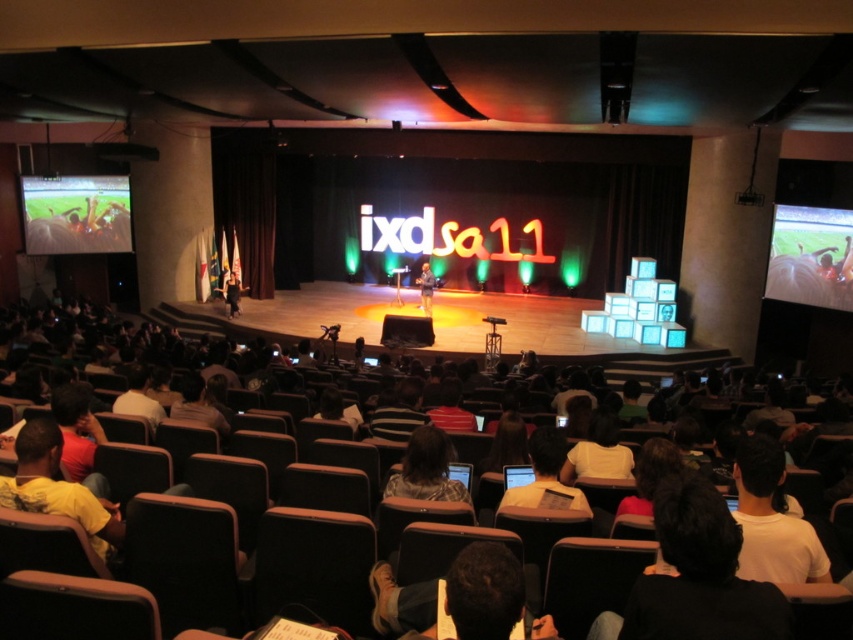
You are a photographer setting up equipment in the auditorium. You have a white plastic laptop at center and a dark blue jeans at center in your shot. Which object will appear smaller in your photo?

The white plastic laptop at center will appear smaller in the photo because it has a lesser height compared to the dark blue jeans at center.

You are standing in the auditorium and see the point marked at coordinates [231,292]. What object is located at that point?

The point at coordinates [231,292] marks dark blue jeans at center.